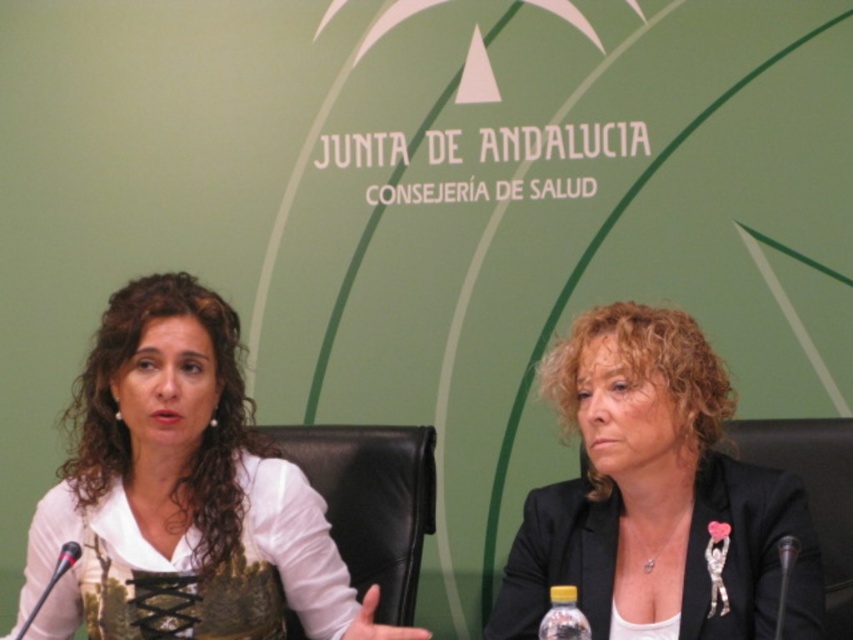
You are organizing a small meeting and need to place a 1.2 meter wide desk between the black leather chair at center and the metallic silver microphone at lower left. Can the desk fit between them?

The black leather chair at center is larger in size than the metallic silver microphone at lower left, but the description does not provide the exact distance between them. Without knowing the actual space available, it is impossible to determine if the desk will fit.

You are a photographer standing in front of the table where the two individuals are seated. You want to take a closeup photo of the white lace blouse at center. Considering your current position, can you estimate how far you need to move forward to get the blouse within the camera frame?

The white lace blouse at center is 1.20 meters away from the viewer. To get it within the camera frame for a closeup, you would need to move forward to reduce the distance, but the exact adjustment depends on your camera lens and desired framing. However, the current distance is 1.20 meters.

You are a photographer at the event and need to capture a closeup shot of both the black matte blazer at center and the translucent plastic bottle at lower center. Given the camera you have can only focus on objects within 8 inches of each other, will you be able to take the photo without moving either object?

The distance between the black matte blazer at center and the translucent plastic bottle at lower center is 9.34 inches, which exceeds the 8 inch focus range of your camera. You will need to move one of the objects closer to achieve the desired shot.